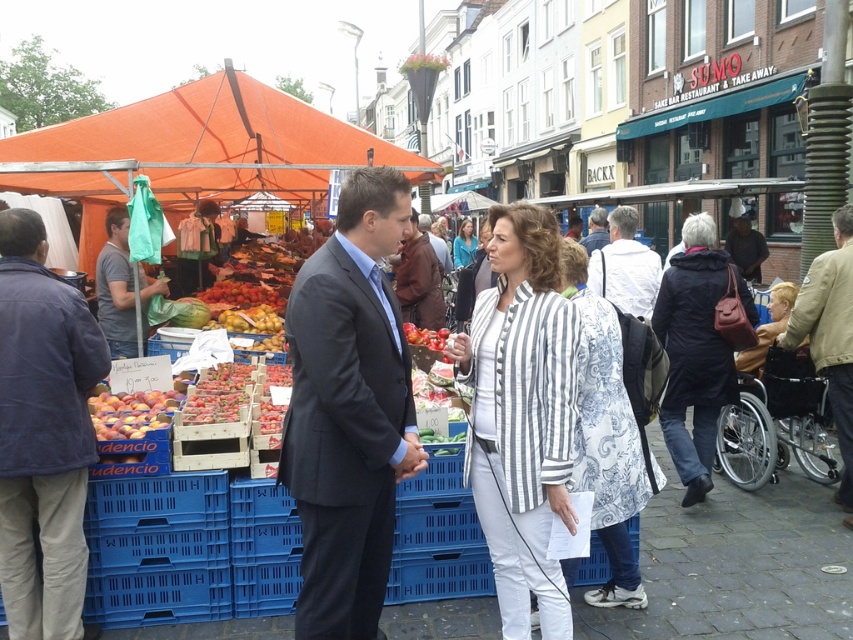
Question: Which of the following is the closest to the observer?

Choices:
 (A) dark blue suit at center
 (B) ripe red tomatoes at center
 (C) dark gray suit at center

Answer: (C)

Question: Is striped cotton jacket at center to the left of striped fabric jacket at center from the viewer's perspective?

Choices:
 (A) no
 (B) yes

Answer: (B)

Question: In this image, where is white printed coat at center located relative to brown leather jacket at lower right?

Choices:
 (A) above
 (B) below

Answer: (B)

Question: Does dark gray suit at center appear over matte gray t-shirt at left?

Choices:
 (A) no
 (B) yes

Answer: (A)

Question: Among these objects, which one is farthest from the camera?

Choices:
 (A) denim jacket at left
 (B) shiny red tomatoes at center
 (C) white cotton jacket at center
 (D) brown leather jacket at center

Answer: (D)

Question: Which object is farther from the camera taking this photo?

Choices:
 (A) brown leather jacket at center
 (B) dark blue coat at center

Answer: (A)